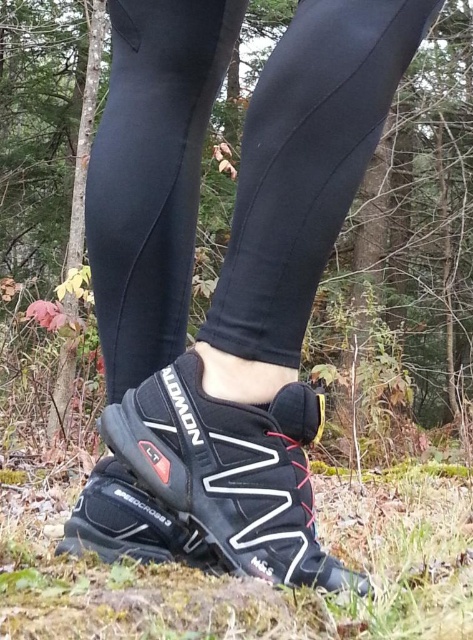
Measure the distance from black matte leggings at center to black mesh shoe at center.

black matte leggings at center and black mesh shoe at center are 6.32 inches apart from each other.

Where is `black matte leggings at center`? Image resolution: width=473 pixels, height=640 pixels. black matte leggings at center is located at coordinates (306, 164).